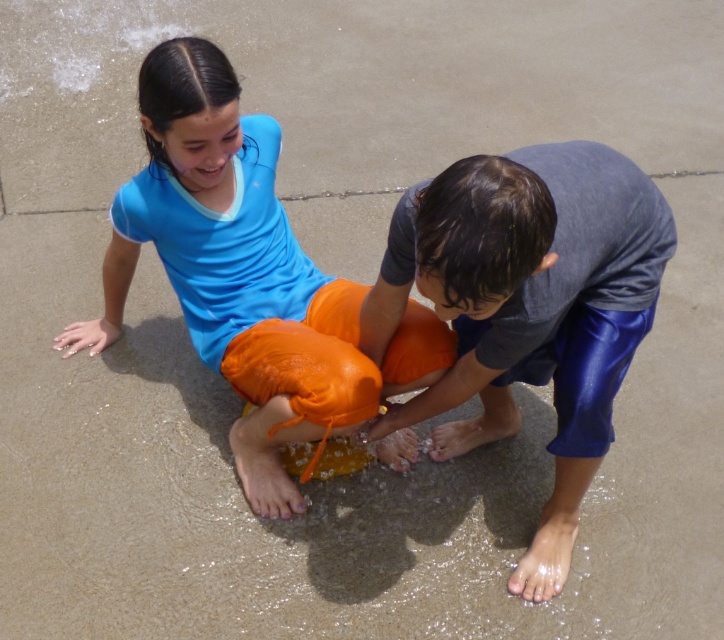
Does blue shiny shorts at lower right have a smaller size compared to matte blue shirt at upper left?

Indeed, blue shiny shorts at lower right has a smaller size compared to matte blue shirt at upper left.

Between blue shiny shorts at lower right and matte blue shirt at upper left, which one has more height?

matte blue shirt at upper left

Where is `blue shiny shorts at lower right`? The height and width of the screenshot is (640, 724). blue shiny shorts at lower right is located at coordinates (526, 307).

You are a GUI agent. You are given a task and a screenshot of the screen. Output one action in this format:
    pyautogui.click(x=<x>, y=<y>)
    Task: Click on the blue shiny shorts at lower right
    
    Given the screenshot: What is the action you would take?
    pyautogui.click(x=526, y=307)